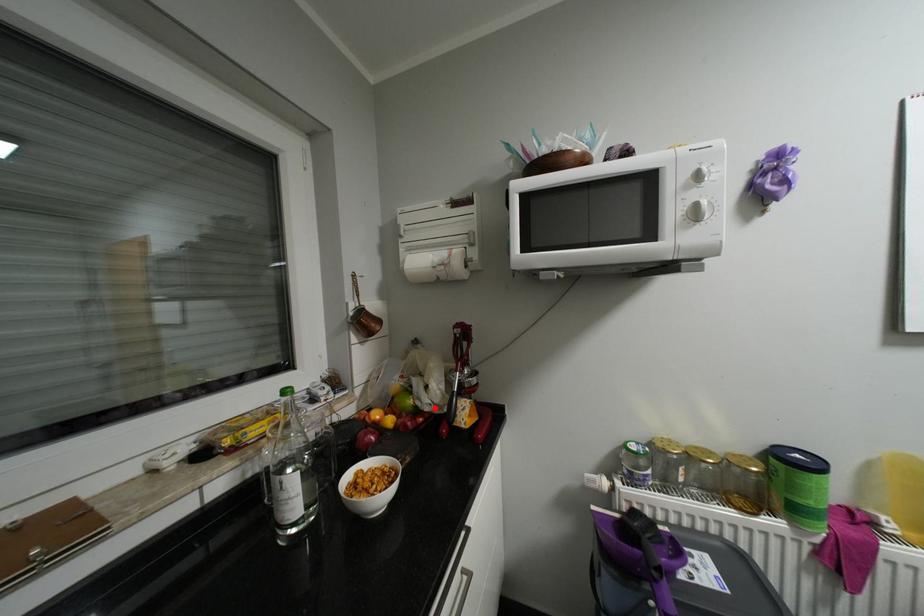
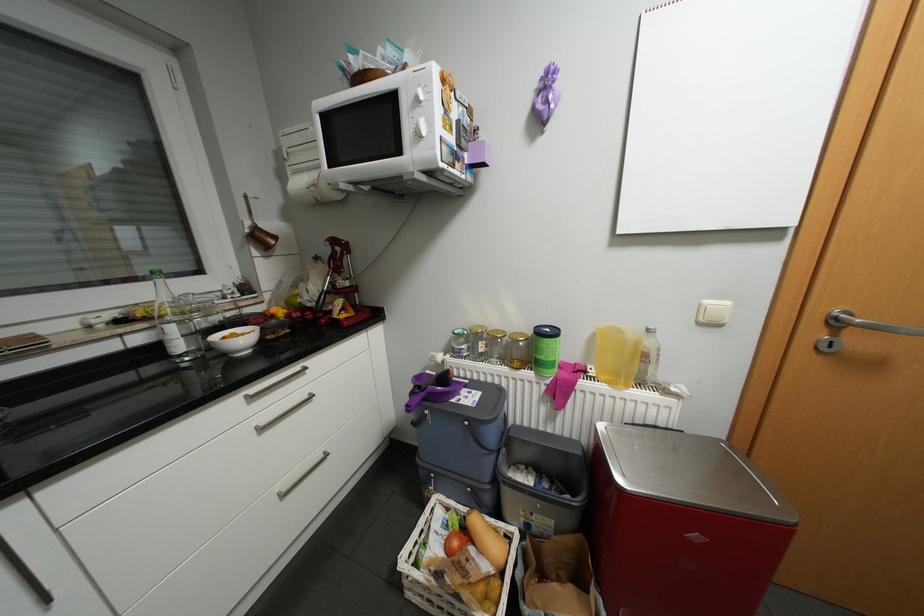
Where in the second image is the point corresponding to the highlighted location from the first image?

(317, 304)